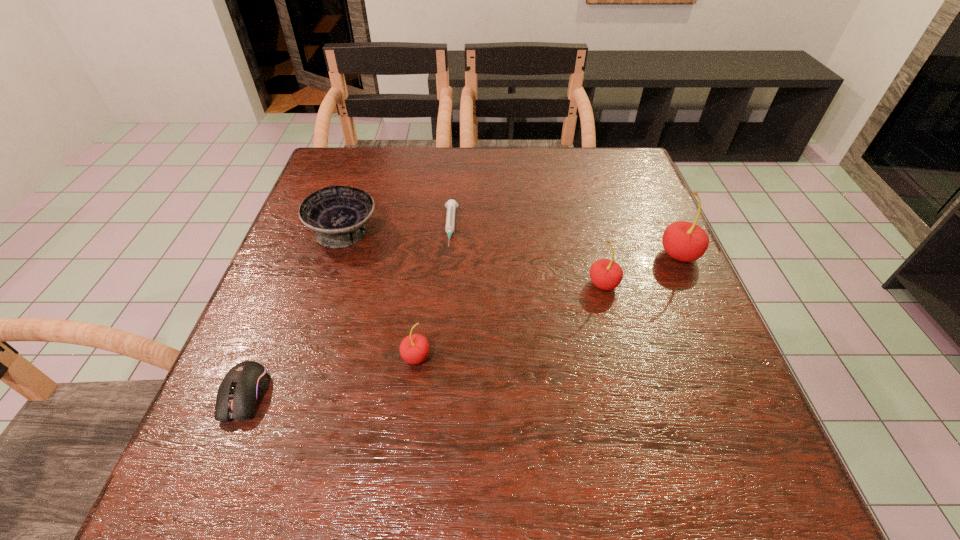
Locate an element on the screen. free space between the third object from left to right and the bowl is located at coordinates (380, 294).

This screenshot has width=960, height=540. In order to click on free space between the third shortest object and the third object from left to right in this screenshot , I will do `click(380, 294)`.

Locate an element on the screen. The width and height of the screenshot is (960, 540). empty space that is in between the farthest cherry and the bowl is located at coordinates (512, 244).

The width and height of the screenshot is (960, 540). Find the location of `unoccupied area between the shortest cherry and the shortest object`. unoccupied area between the shortest cherry and the shortest object is located at coordinates (433, 292).

Where is `vacant space that is in between the third object from right to left and the fourth shortest object`? The image size is (960, 540). vacant space that is in between the third object from right to left and the fourth shortest object is located at coordinates (433, 292).

The image size is (960, 540). Find the location of `object that is the second closest to the tallest cherry`. object that is the second closest to the tallest cherry is located at coordinates (451, 204).

Select which object appears as the fifth closest to the computer mouse. Please provide its 2D coordinates. Your answer should be formatted as a tuple, i.e. [(x, y)], where the tuple contains the x and y coordinates of a point satisfying the conditions above.

[(684, 241)]

The height and width of the screenshot is (540, 960). In order to click on cherry that is the second closest to the leftmost cherry in this screenshot , I will do `click(684, 241)`.

The width and height of the screenshot is (960, 540). In order to click on cherry that is the closest to the computer mouse in this screenshot , I will do `click(414, 349)`.

The image size is (960, 540). In order to click on free space that satisfies the following two spatial constraints: 1. at the needle end of the farthest cherry; 2. on the right side of the syringe in this screenshot , I will do `click(448, 255)`.